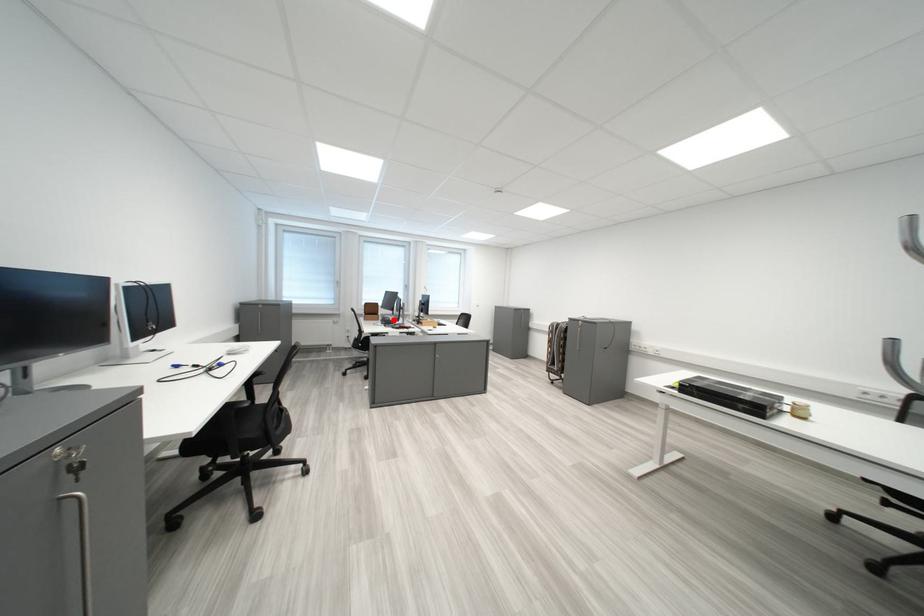
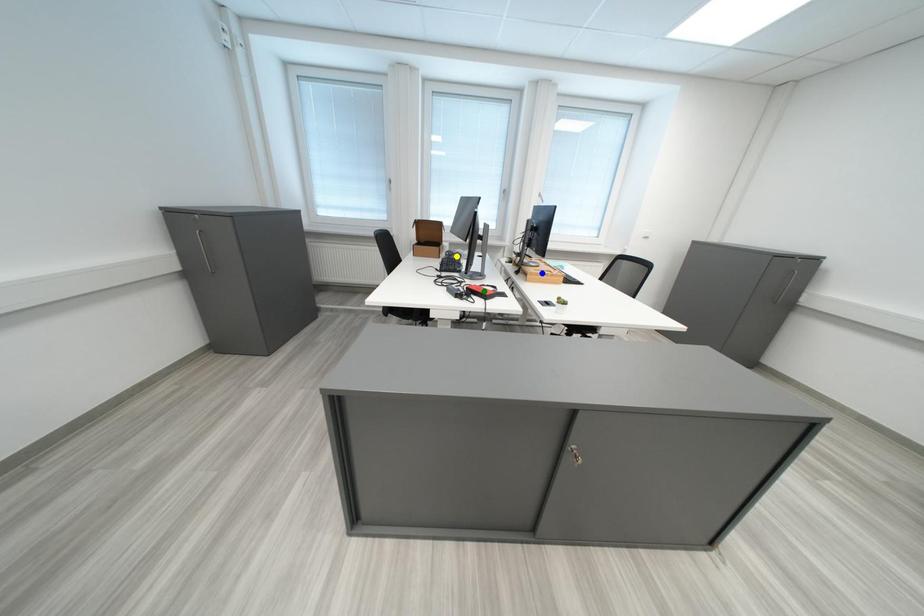
Question: I am providing you with two images of the same scene from different viewpoints. A red point is marked on the first image. You are given multiple points on the second image. Which spot in image 2 lines up with the point in image 1?

Choices:
 (A) blue point
 (B) yellow point
 (C) green point

Answer: (B)